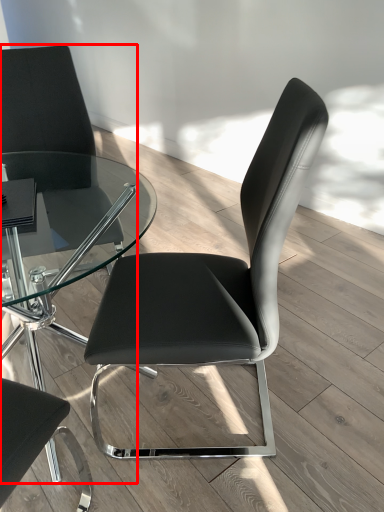
Question: Where is chair (annotated by the red box) located in relation to chair in the image?

Choices:
 (A) left
 (B) right

Answer: (A)